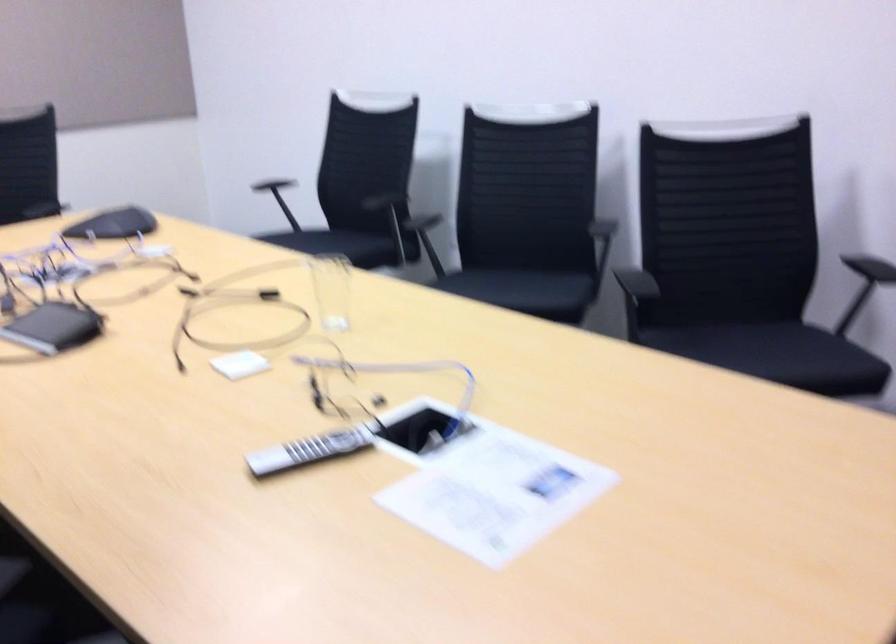
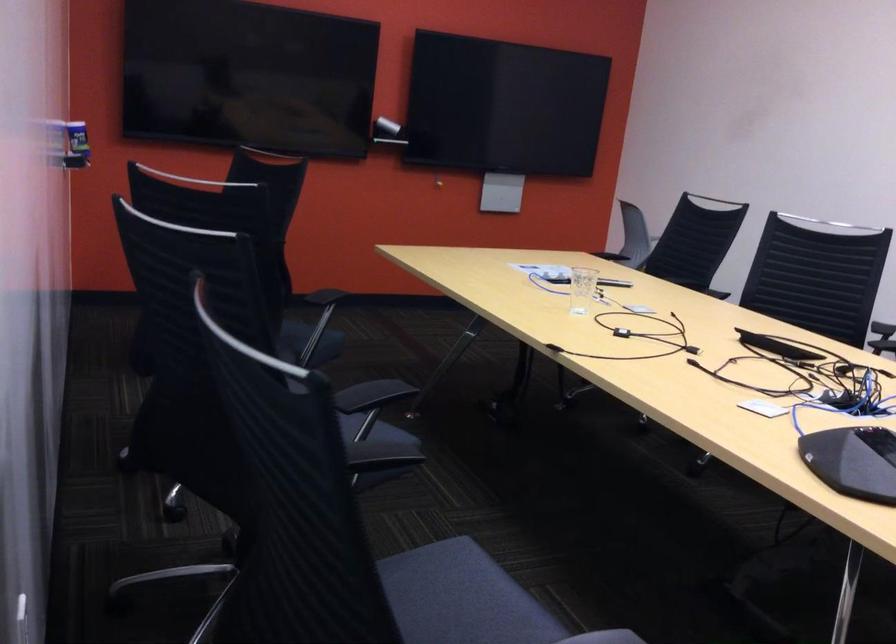
Find the pixel in the second image that matches (323,239) in the first image.

(461, 598)